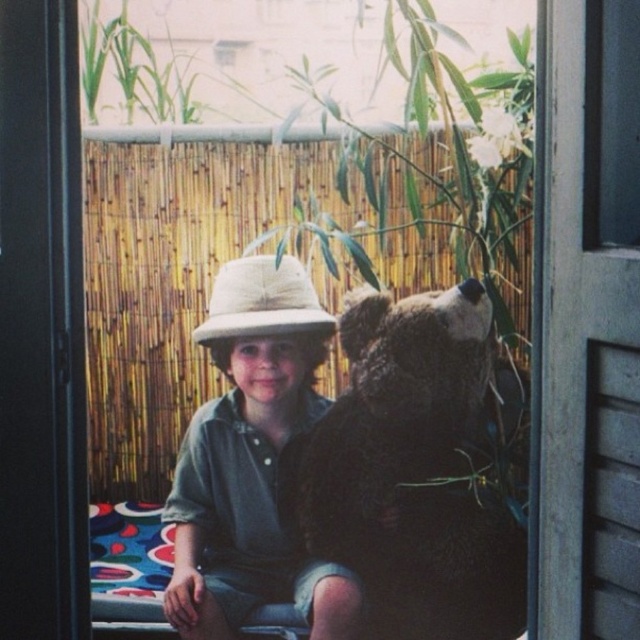
Between dark brown plush bear at center and natural straw hat at center, which one has more height?

Standing taller between the two is dark brown plush bear at center.

Does dark brown plush bear at center come in front of natural straw hat at center?

Yes.

Image resolution: width=640 pixels, height=640 pixels. What do you see at coordinates (412, 470) in the screenshot?
I see `dark brown plush bear at center` at bounding box center [412, 470].

Identify the location of dark brown plush bear at center. (412, 470).

From the picture: Does matte khaki hat at center appear on the right side of natural straw hat at center?

Incorrect, matte khaki hat at center is not on the right side of natural straw hat at center.

Which is more to the right, matte khaki hat at center or natural straw hat at center?

Positioned to the right is natural straw hat at center.

This screenshot has width=640, height=640. Identify the location of matte khaki hat at center. (252, 460).

Find the location of a particular element. matte khaki hat at center is located at coordinates (252, 460).

Who is taller, dark brown plush bear at center or matte khaki hat at center?

With more height is matte khaki hat at center.

Does point (385, 608) lie in front of point (221, 440)?

No, it is not.

Find the location of a particular element. dark brown plush bear at center is located at coordinates (412, 470).